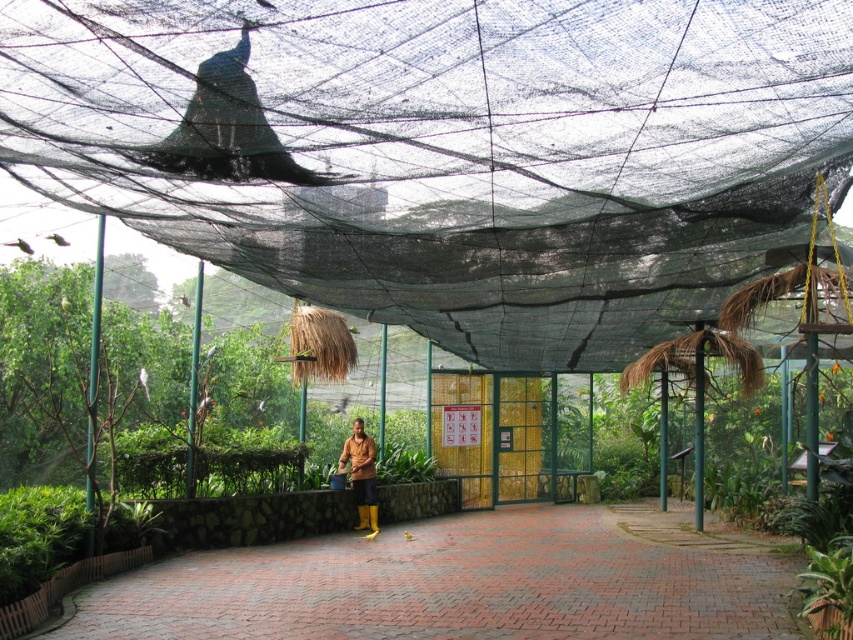
Question: Does brick paved path at center appear on the left side of green leafy plant at lower right?

Choices:
 (A) yes
 (B) no

Answer: (A)

Question: Which of the following is the farthest from the observer?

Choices:
 (A) green leafy plant at lower right
 (B) brick paved path at center
 (C) brown rubber boots at center
 (D) black mesh net at upper center

Answer: (C)

Question: Which of the following is the farthest from the observer?

Choices:
 (A) (68, 147)
 (B) (430, 636)
 (C) (364, 435)

Answer: (C)

Question: Does black mesh net at upper center have a larger size compared to brown rubber boots at center?

Choices:
 (A) no
 (B) yes

Answer: (A)

Question: From the image, what is the correct spatial relationship of black mesh net at upper center in relation to green leafy plant at lower right?

Choices:
 (A) left
 (B) right

Answer: (A)

Question: Which point is closer to the camera?

Choices:
 (A) (654, 100)
 (B) (825, 611)

Answer: (A)